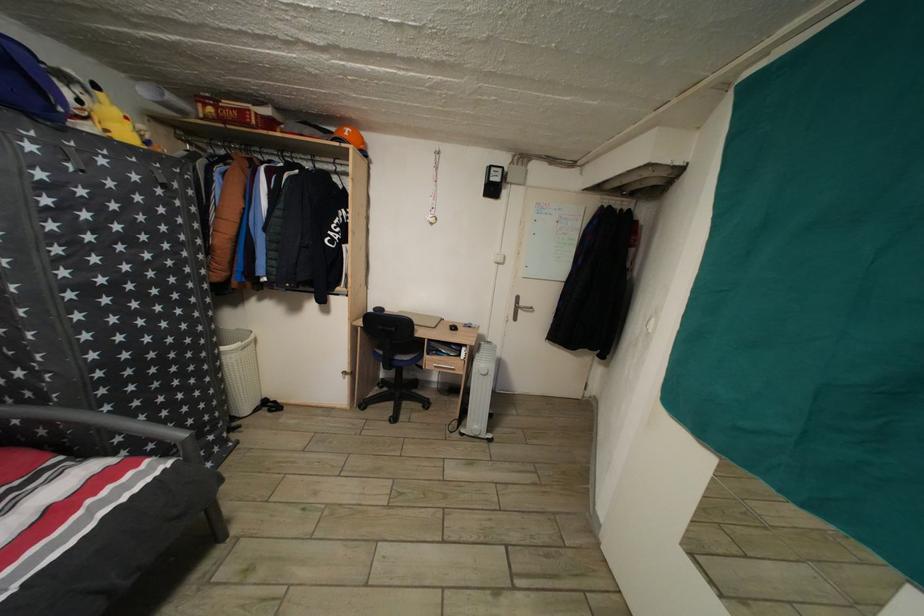
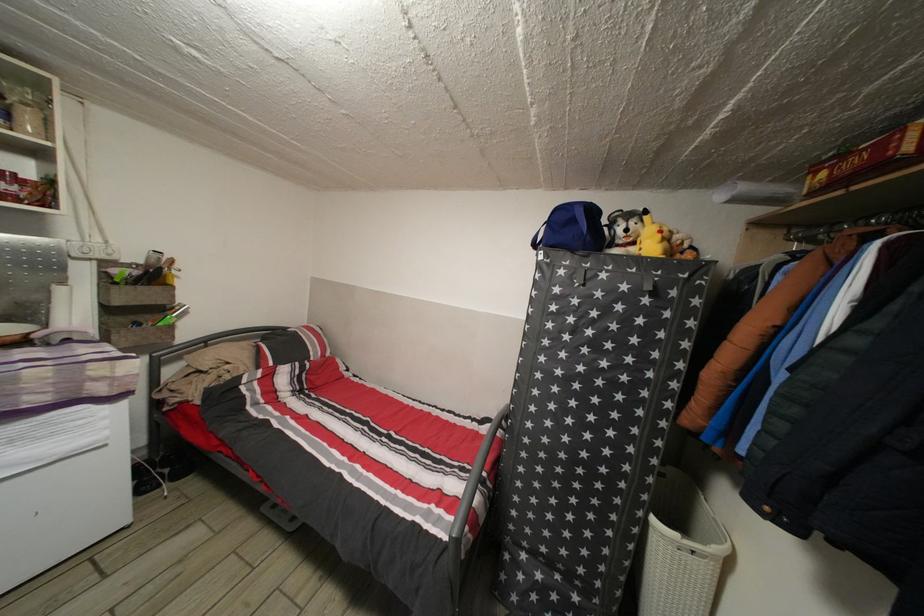
Question: How did the camera likely rotate?

Choices:
 (A) Left
 (B) Right
 (C) Up
 (D) Down

Answer: (A)